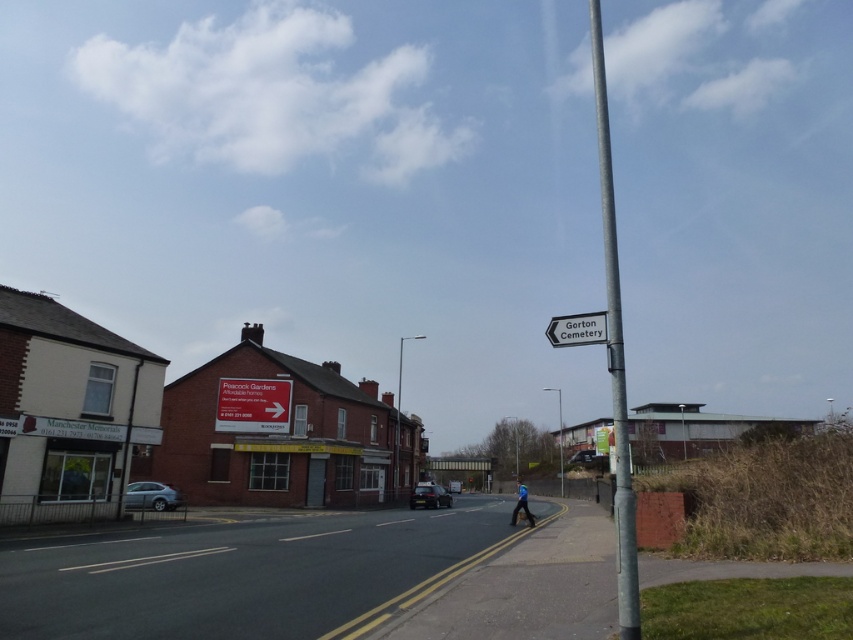
Who is taller, silver metallic pole at right or white plastic sign at center?

Standing taller between the two is silver metallic pole at right.

Is silver metallic pole at right positioned in front of white plastic sign at center?

Yes, silver metallic pole at right is in front of white plastic sign at center.

What do you see at coordinates (614, 356) in the screenshot? I see `silver metallic pole at right` at bounding box center [614, 356].

Locate an element on the screen. This screenshot has height=640, width=853. silver metallic pole at right is located at coordinates (614, 356).

Does point (590, 342) come behind point (520, 499)?

No, it is not.

Who is more distant from viewer, (x=587, y=316) or (x=521, y=502)?

The point (x=521, y=502) is more distant.

Locate an element on the screen. white plastic sign at upper center is located at coordinates pyautogui.click(x=577, y=330).

Is silver metallic pole at right wider than blue fabric person at lower center?

Indeed, silver metallic pole at right has a greater width compared to blue fabric person at lower center.

Can you confirm if silver metallic pole at right is thinner than blue fabric person at lower center?

No, silver metallic pole at right is not thinner than blue fabric person at lower center.

Locate an element on the screen. The width and height of the screenshot is (853, 640). silver metallic pole at right is located at coordinates (614, 356).

The image size is (853, 640). I want to click on silver metallic pole at right, so click(614, 356).